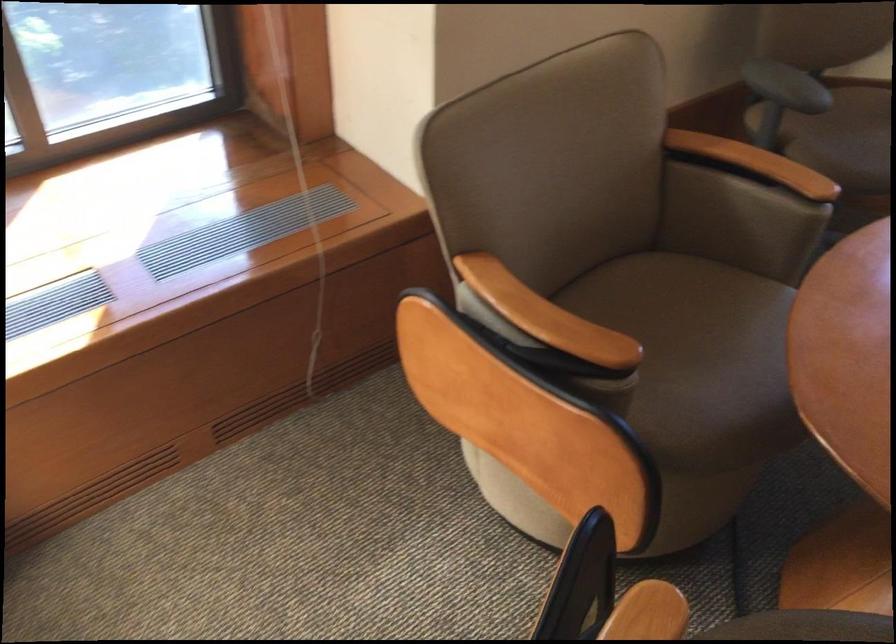
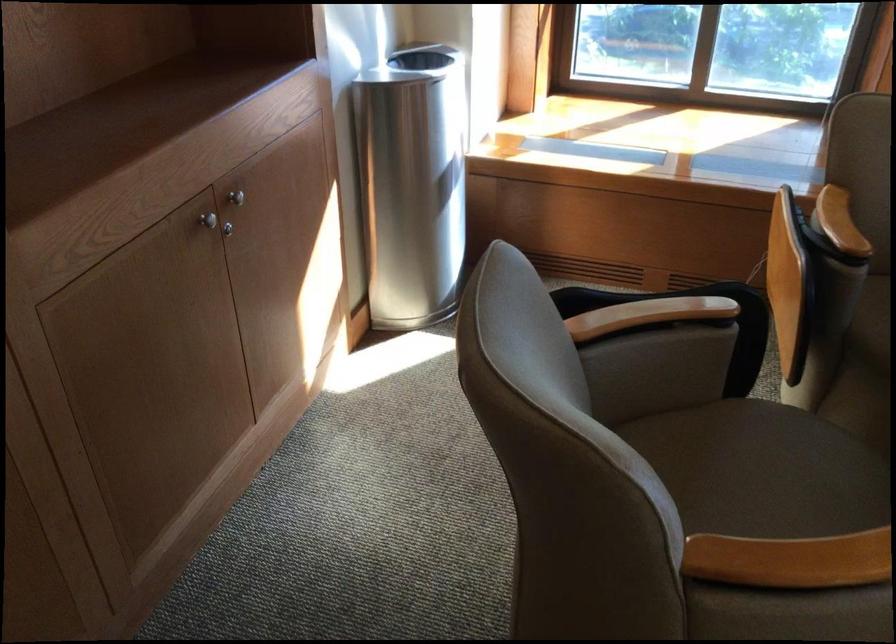
Locate, in the second image, the point that corresponds to point 618,424 in the first image.

(855, 330)